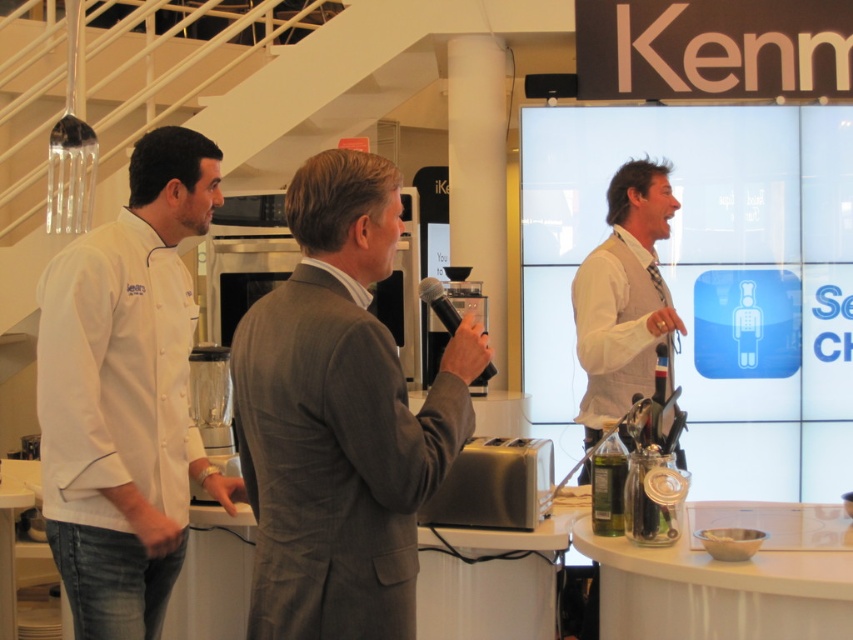
Question: Considering the real-world distances, which object is closest to the gray wool suit at center?

Choices:
 (A) white glossy shirt at center
 (B) white matte chef coat at left

Answer: (B)

Question: Is gray wool suit at center wider than white glossy shirt at center?

Choices:
 (A) yes
 (B) no

Answer: (A)

Question: Which point is closer to the camera?

Choices:
 (A) white matte chef coat at left
 (B) white glossy shirt at center
 (C) gray wool suit at center

Answer: (C)

Question: Where is gray wool suit at center located in relation to white matte chef coat at left in the image?

Choices:
 (A) below
 (B) above

Answer: (B)

Question: Is gray wool suit at center closer to camera compared to white glossy shirt at center?

Choices:
 (A) no
 (B) yes

Answer: (B)

Question: Estimate the real-world distances between objects in this image. Which object is closer to the white glossy shirt at center?

Choices:
 (A) gray wool suit at center
 (B) white matte chef coat at left

Answer: (A)